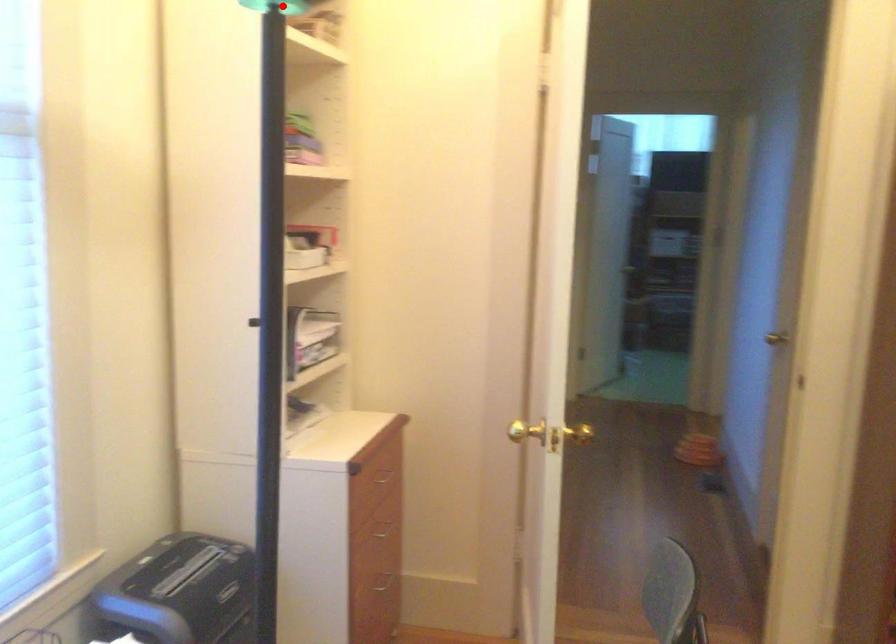
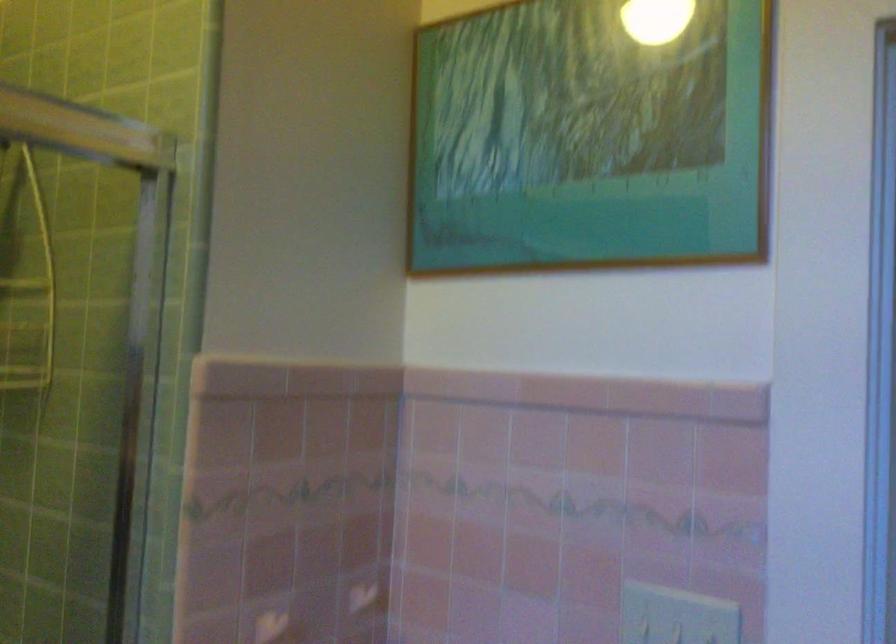
Question: I am providing you with two images of the same scene from different viewpoints. A red point is marked on the first image. Can you still see the location of the red point in image 2?

Choices:
 (A) Yes
 (B) No

Answer: (B)